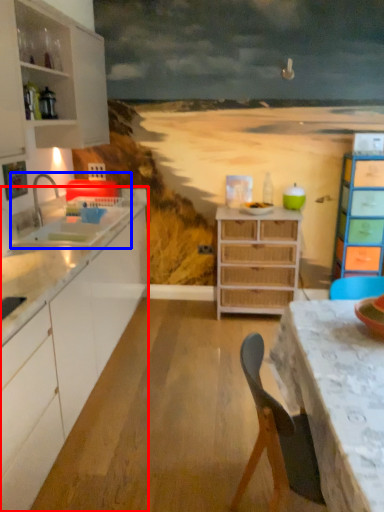
Question: Which object appears farthest to the camera in this image, cabinetry (highlighted by a red box) or sink (highlighted by a blue box)?

Choices:
 (A) cabinetry
 (B) sink

Answer: (B)